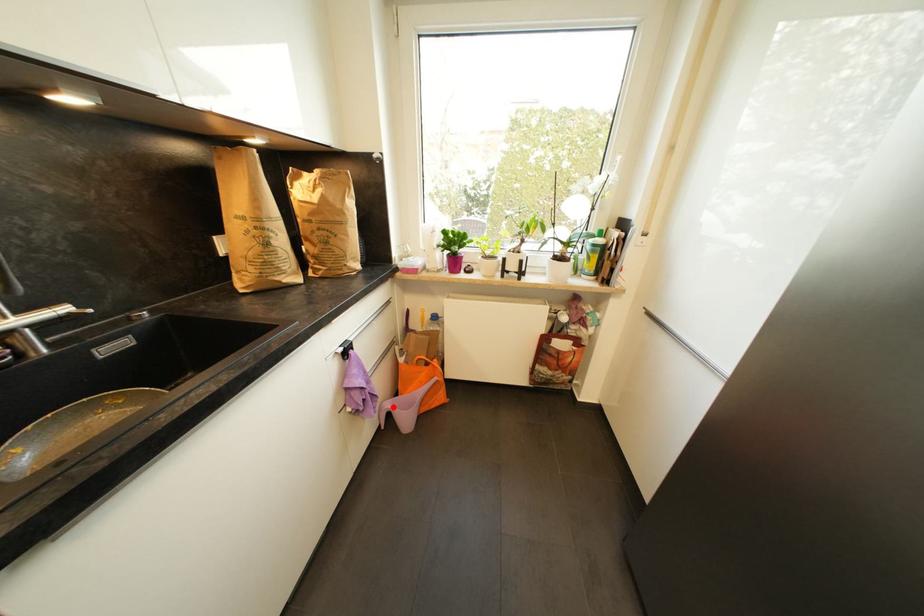
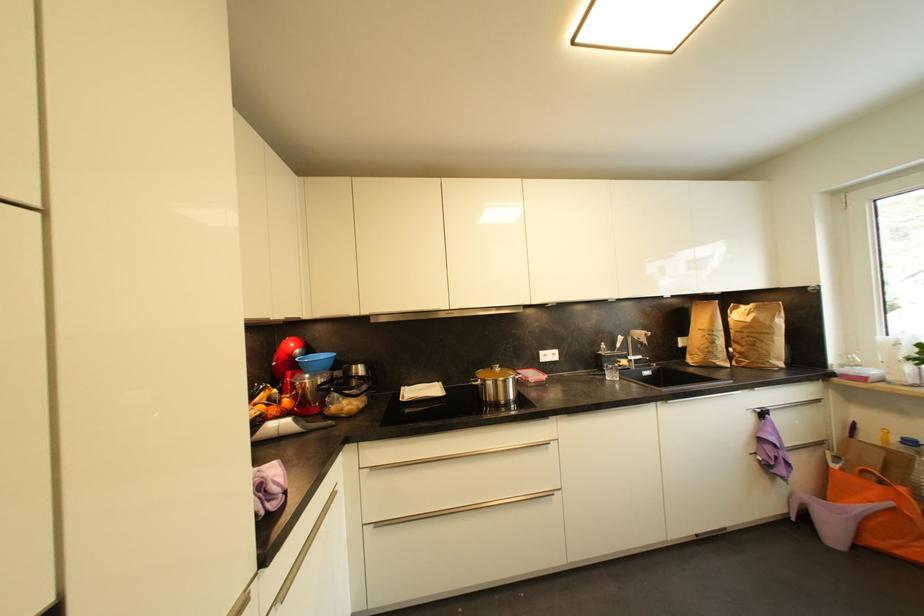
In the second image, find the point that corresponds to the highlighted location in the first image.

(811, 498)